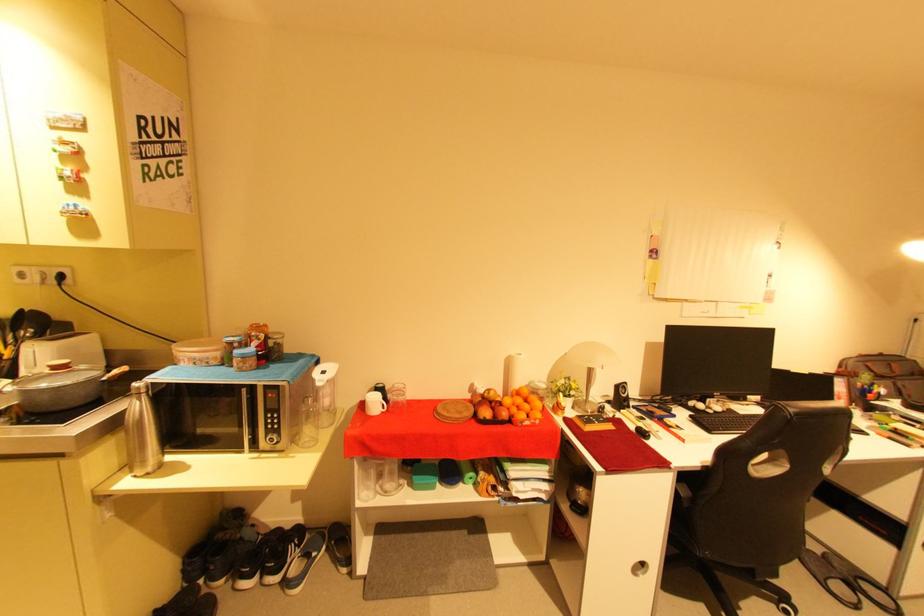
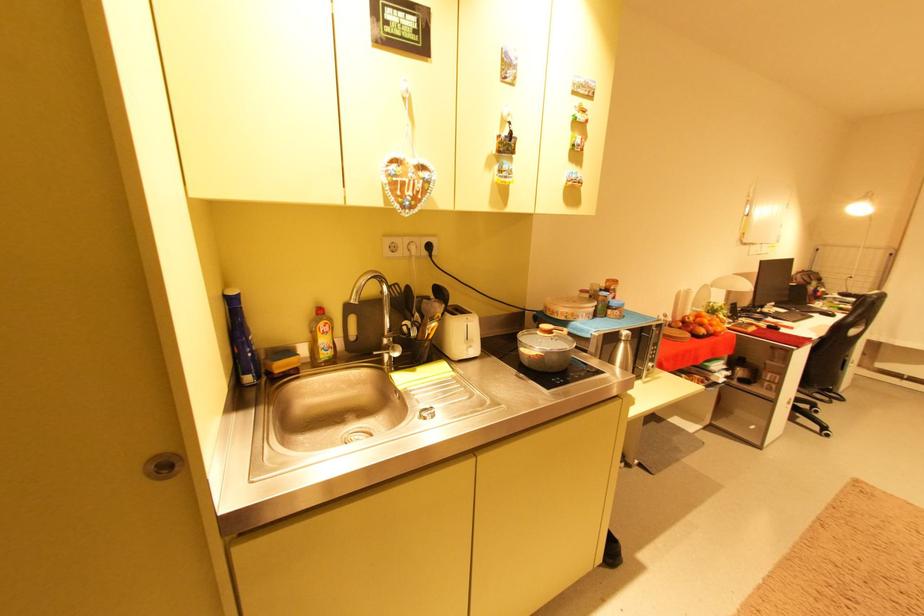
Question: In a continuous first-person perspective shot, in which direction is the camera moving?

Choices:
 (A) Left
 (B) Right
 (C) Forward
 (D) Backward

Answer: (A)